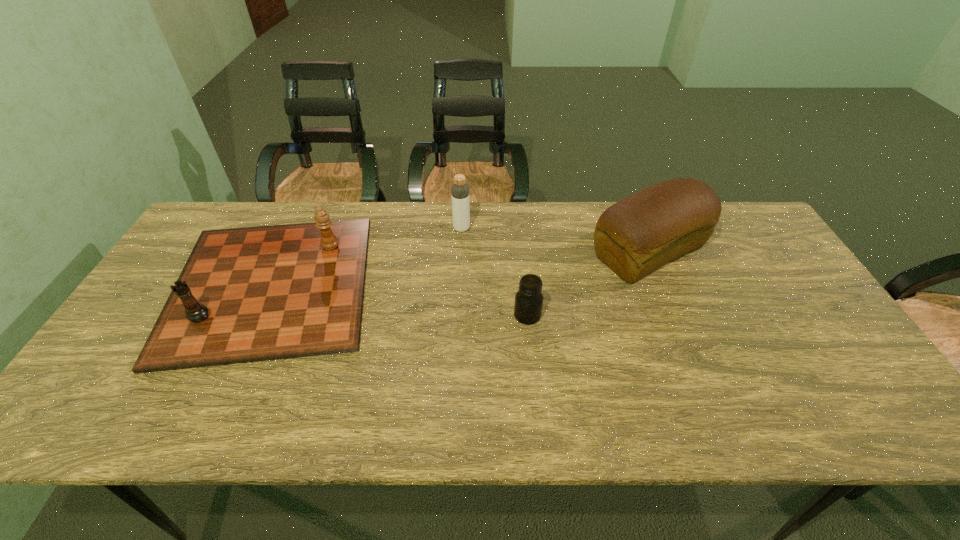
Image resolution: width=960 pixels, height=540 pixels. What are the coordinates of `free spot between the third object from left to right and the bread` in the screenshot? It's located at (588, 284).

Locate an element on the screen. free space between the gameboard and the bread is located at coordinates (460, 268).

Where is `vacant area between the third object from left to right and the bottle`? Image resolution: width=960 pixels, height=540 pixels. vacant area between the third object from left to right and the bottle is located at coordinates (494, 272).

Find the location of a particular element. The height and width of the screenshot is (540, 960). vacant area that lies between the bread and the second object from right to left is located at coordinates (588, 284).

This screenshot has width=960, height=540. I want to click on free space between the bread and the third tallest object, so click(460, 268).

Point out which object is positioned as the second nearest to the second object from right to left. Please provide its 2D coordinates. Your answer should be formatted as a tuple, i.e. [(x, y)], where the tuple contains the x and y coordinates of a point satisfying the conditions above.

[(459, 191)]

This screenshot has height=540, width=960. In order to click on the closest object to the second object from right to left in this screenshot , I will do `click(637, 235)`.

At what (x,y) coordinates should I click in order to perform the action: click on blank area in the image that satisfies the following two spatial constraints: 1. on the front side of the leftmost object; 2. on the left side of the second object from right to left. Please return your answer as a coordinate pair (x, y). The image size is (960, 540). Looking at the image, I should click on (258, 315).

Find the location of `free region that satisfies the following two spatial constraints: 1. on the back side of the gameboard; 2. on the right side of the bread`. free region that satisfies the following two spatial constraints: 1. on the back side of the gameboard; 2. on the right side of the bread is located at coordinates (287, 252).